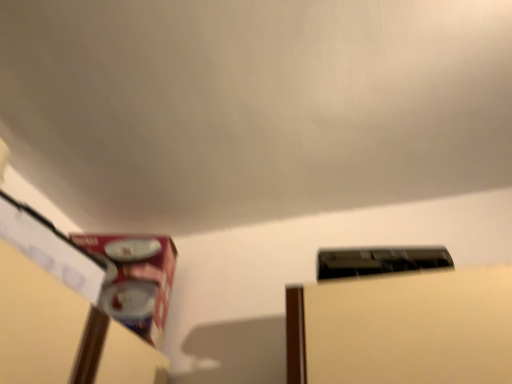
What do you see at coordinates (379, 261) in the screenshot?
I see `black glossy water heater at upper right, arranged as the second water heater when viewed from the left` at bounding box center [379, 261].

The width and height of the screenshot is (512, 384). I want to click on black glossy water heater at upper right, the second water heater positioned from the back, so click(x=379, y=261).

What is the approximate height of black glossy water heater at upper right, arranged as the first water heater when viewed from the right?

black glossy water heater at upper right, arranged as the first water heater when viewed from the right, is 3.65 inches in height.

Where is `metallic silver water heater at lower left, which is counted as the first water heater, starting from the back`? The width and height of the screenshot is (512, 384). metallic silver water heater at lower left, which is counted as the first water heater, starting from the back is located at coordinates (135, 279).

Measure the distance between point (129, 247) and camera.

Point (129, 247) is 1.07 meters from camera.

How much space does metallic silver water heater at lower left, which is counted as the first water heater, starting from the back, occupy horizontally?

It is 10.83 inches.

The height and width of the screenshot is (384, 512). Describe the element at coordinates (135, 279) in the screenshot. I see `metallic silver water heater at lower left, which ranks as the 2th water heater in right-to-left order` at that location.

Locate an element on the screen. The height and width of the screenshot is (384, 512). black glossy water heater at upper right, the second water heater positioned from the back is located at coordinates (379, 261).

Which is more to the left, metallic silver water heater at lower left, which is counted as the first water heater, starting from the back, or black glossy water heater at upper right, which is the 1th water heater from front to back?

Positioned to the left is metallic silver water heater at lower left, which is counted as the first water heater, starting from the back.

Considering the positions of objects metallic silver water heater at lower left, which ranks as the 2th water heater in right-to-left order, and black glossy water heater at upper right, arranged as the second water heater when viewed from the left, in the image provided, who is behind, metallic silver water heater at lower left, which ranks as the 2th water heater in right-to-left order, or black glossy water heater at upper right, arranged as the second water heater when viewed from the left,?

Positioned behind is metallic silver water heater at lower left, which ranks as the 2th water heater in right-to-left order.

Is point (155, 246) farther from viewer compared to point (324, 256)?

Yes, point (155, 246) is behind point (324, 256).

From the image's perspective, which is above, metallic silver water heater at lower left, which is counted as the second water heater, starting from the front, or black glossy water heater at upper right, arranged as the first water heater when viewed from the right?

black glossy water heater at upper right, arranged as the first water heater when viewed from the right, is shown above in the image.

From a real-world perspective, is metallic silver water heater at lower left, which is counted as the first water heater, starting from the back, beneath black glossy water heater at upper right, arranged as the first water heater when viewed from the right?

No, from a real-world perspective, metallic silver water heater at lower left, which is counted as the first water heater, starting from the back, is not below black glossy water heater at upper right, arranged as the first water heater when viewed from the right.

Considering the sizes of objects metallic silver water heater at lower left, which is counted as the second water heater, starting from the front, and black glossy water heater at upper right, which is the 1th water heater from front to back, in the image provided, who is thinner, metallic silver water heater at lower left, which is counted as the second water heater, starting from the front, or black glossy water heater at upper right, which is the 1th water heater from front to back,?

black glossy water heater at upper right, which is the 1th water heater from front to back.

Between metallic silver water heater at lower left, which ranks as the 2th water heater in right-to-left order, and black glossy water heater at upper right, the second water heater positioned from the back, which one has less height?

black glossy water heater at upper right, the second water heater positioned from the back.

Is metallic silver water heater at lower left, which is counted as the first water heater, starting from the back, smaller than black glossy water heater at upper right, the second water heater positioned from the back?

Incorrect, metallic silver water heater at lower left, which is counted as the first water heater, starting from the back, is not smaller in size than black glossy water heater at upper right, the second water heater positioned from the back.

Is metallic silver water heater at lower left, which is counted as the second water heater, starting from the front, surrounding black glossy water heater at upper right, the second water heater positioned from the back?

No, black glossy water heater at upper right, the second water heater positioned from the back, is not a part of metallic silver water heater at lower left, which is counted as the second water heater, starting from the front.

Would you say metallic silver water heater at lower left, which is counted as the second water heater, starting from the front, is a long distance from black glossy water heater at upper right, which is the 1th water heater from front to back?

No, there isn't a large distance between metallic silver water heater at lower left, which is counted as the second water heater, starting from the front, and black glossy water heater at upper right, which is the 1th water heater from front to back.

Is metallic silver water heater at lower left, the first water heater from the left, facing away from black glossy water heater at upper right, arranged as the first water heater when viewed from the right?

No, black glossy water heater at upper right, arranged as the first water heater when viewed from the right, is not at the back of metallic silver water heater at lower left, the first water heater from the left.

Image resolution: width=512 pixels, height=384 pixels. I want to click on water heater lying behind the black glossy water heater at upper right, arranged as the second water heater when viewed from the left, so click(x=135, y=279).

Between black glossy water heater at upper right, arranged as the second water heater when viewed from the left, and metallic silver water heater at lower left, the first water heater from the left, which one appears on the left side from the viewer's perspective?

metallic silver water heater at lower left, the first water heater from the left.

Is the position of black glossy water heater at upper right, which is the 1th water heater from front to back, more distant than that of metallic silver water heater at lower left, which ranks as the 2th water heater in right-to-left order?

No, black glossy water heater at upper right, which is the 1th water heater from front to back, is closer to the viewer.

Does point (365, 260) come behind point (122, 249)?

No, (365, 260) is in front of (122, 249).

From the image's perspective, relative to metallic silver water heater at lower left, which is counted as the second water heater, starting from the front, is black glossy water heater at upper right, which is the 1th water heater from front to back, above or below?

black glossy water heater at upper right, which is the 1th water heater from front to back, is situated higher than metallic silver water heater at lower left, which is counted as the second water heater, starting from the front, in the image.

Consider the image. From a real-world perspective, is black glossy water heater at upper right, arranged as the second water heater when viewed from the left, physically above metallic silver water heater at lower left, which is counted as the first water heater, starting from the back?

No, from a real-world perspective, black glossy water heater at upper right, arranged as the second water heater when viewed from the left, is not over metallic silver water heater at lower left, which is counted as the first water heater, starting from the back

Looking at their sizes, would you say black glossy water heater at upper right, the second water heater positioned from the back, is wider or thinner than metallic silver water heater at lower left, the first water heater from the left?

Clearly, black glossy water heater at upper right, the second water heater positioned from the back, has less width compared to metallic silver water heater at lower left, the first water heater from the left.

Considering the sizes of black glossy water heater at upper right, arranged as the first water heater when viewed from the right, and metallic silver water heater at lower left, which is counted as the first water heater, starting from the back, in the image, is black glossy water heater at upper right, arranged as the first water heater when viewed from the right, taller or shorter than metallic silver water heater at lower left, which is counted as the first water heater, starting from the back,?

Considering their sizes, black glossy water heater at upper right, arranged as the first water heater when viewed from the right, has less height than metallic silver water heater at lower left, which is counted as the first water heater, starting from the back.

Between black glossy water heater at upper right, arranged as the first water heater when viewed from the right, and metallic silver water heater at lower left, which ranks as the 2th water heater in right-to-left order, which one has larger size?

metallic silver water heater at lower left, which ranks as the 2th water heater in right-to-left order.

Is black glossy water heater at upper right, arranged as the first water heater when viewed from the right, surrounding metallic silver water heater at lower left, which is counted as the first water heater, starting from the back?

That's incorrect, metallic silver water heater at lower left, which is counted as the first water heater, starting from the back, is not inside black glossy water heater at upper right, arranged as the first water heater when viewed from the right.

Would you consider black glossy water heater at upper right, which is the 1th water heater from front to back, to be distant from metallic silver water heater at lower left, the first water heater from the left?

black glossy water heater at upper right, which is the 1th water heater from front to back, is actually quite close to metallic silver water heater at lower left, the first water heater from the left.

Could you tell me if black glossy water heater at upper right, the second water heater positioned from the back, is facing metallic silver water heater at lower left, which is counted as the first water heater, starting from the back?

No, black glossy water heater at upper right, the second water heater positioned from the back, is not turned towards metallic silver water heater at lower left, which is counted as the first water heater, starting from the back.

Locate an element on the screen. This screenshot has height=384, width=512. water heater above the black glossy water heater at upper right, which is the 1th water heater from front to back (from a real-world perspective) is located at coordinates (135, 279).

Locate an element on the screen. water heater behind the black glossy water heater at upper right, the second water heater positioned from the back is located at coordinates (135, 279).

This screenshot has width=512, height=384. I want to click on water heater on the right of metallic silver water heater at lower left, which is counted as the first water heater, starting from the back, so click(x=379, y=261).